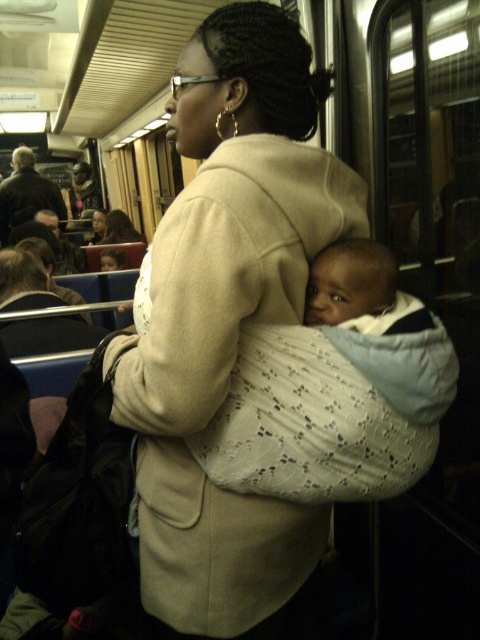
You are a passenger in the subway car and want to know which of the two points, point (x=207, y=637) or point (x=113, y=237), is closer to you. Can you determine this based on their positions?

Point (x=207, y=637) is in front of point (x=113, y=237), so it is closer to you.

You are a designer creating a catalog for baby products. You need to compare the size of the beige fabric baby carrier at center and the matte beige coat at center in the image. Which one is smaller?

The beige fabric baby carrier at center is smaller than the matte beige coat at center.

You are standing in the train car and want to know which of the two points, point (188, 394) or point (20, 150), is nearer to you. Can you determine this based on the scene?

Point (188, 394) is closer to the viewer than point (20, 150).